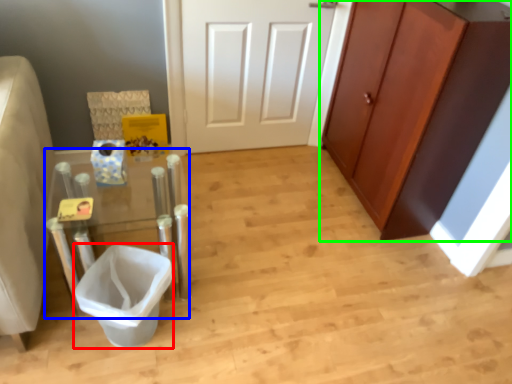
Question: Which object is positioned closest to toilet bowl (highlighted by a red box)? Select from vanity (highlighted by a blue box) and cabinetry (highlighted by a green box).

Choices:
 (A) vanity
 (B) cabinetry

Answer: (A)